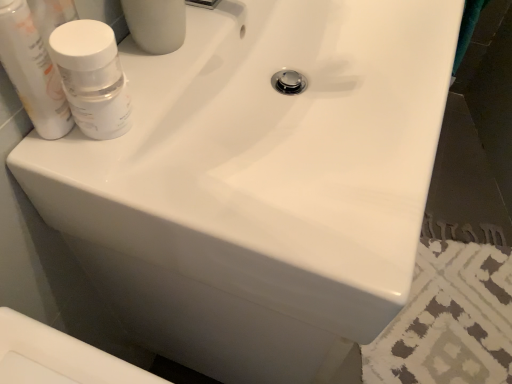
What is the approximate width of white glossy bottle at upper left, acting as the 1th mouthwash starting from the left?

It is 1.73 inches.

Find the location of `white glossy bottle at upper left, acting as the 1th mouthwash starting from the left`. white glossy bottle at upper left, acting as the 1th mouthwash starting from the left is located at coordinates (32, 71).

Describe the element at coordinates (32, 71) in the screenshot. The width and height of the screenshot is (512, 384). I see `white glossy bottle at upper left, acting as the 1th mouthwash starting from the left` at that location.

How much space does white glossy bottle at upper left, acting as the 1th mouthwash starting from the left, occupy vertically?

white glossy bottle at upper left, acting as the 1th mouthwash starting from the left, is 6.80 inches tall.

How much space does white matte bottle at upper left, acting as the second mouthwash starting from the left, occupy horizontally?

white matte bottle at upper left, acting as the second mouthwash starting from the left, is 2.46 inches wide.

Identify the location of white matte bottle at upper left, which is counted as the 1th mouthwash, starting from the right. This screenshot has width=512, height=384. (92, 77).

This screenshot has height=384, width=512. Describe the element at coordinates (92, 77) in the screenshot. I see `white matte bottle at upper left, acting as the second mouthwash starting from the left` at that location.

Identify the location of white glossy bottle at upper left, the 2th mouthwash from the right. The width and height of the screenshot is (512, 384). (32, 71).

Consider the image. Does white matte bottle at upper left, acting as the second mouthwash starting from the left, appear on the right side of white glossy bottle at upper left, acting as the 1th mouthwash starting from the left?

Yes, white matte bottle at upper left, acting as the second mouthwash starting from the left, is to the right of white glossy bottle at upper left, acting as the 1th mouthwash starting from the left.

Considering the relative positions of white matte bottle at upper left, which is counted as the 1th mouthwash, starting from the right, and white glossy bottle at upper left, the 2th mouthwash from the right, in the image provided, is white matte bottle at upper left, which is counted as the 1th mouthwash, starting from the right, in front of white glossy bottle at upper left, the 2th mouthwash from the right,?

No, white matte bottle at upper left, which is counted as the 1th mouthwash, starting from the right, is behind white glossy bottle at upper left, the 2th mouthwash from the right.

Does point (108, 115) lie behind point (1, 58)?

Yes.

From the image's perspective, is white matte bottle at upper left, which is counted as the 1th mouthwash, starting from the right, on white glossy bottle at upper left, acting as the 1th mouthwash starting from the left?

Incorrect, from the image's perspective, white matte bottle at upper left, which is counted as the 1th mouthwash, starting from the right, is lower than white glossy bottle at upper left, acting as the 1th mouthwash starting from the left.

From a real-world perspective, which is physically below, white matte bottle at upper left, which is counted as the 1th mouthwash, starting from the right, or white glossy bottle at upper left, acting as the 1th mouthwash starting from the left?

white matte bottle at upper left, which is counted as the 1th mouthwash, starting from the right, is physically lower.

Considering the sizes of objects white matte bottle at upper left, which is counted as the 1th mouthwash, starting from the right, and white glossy bottle at upper left, the 2th mouthwash from the right, in the image provided, who is thinner, white matte bottle at upper left, which is counted as the 1th mouthwash, starting from the right, or white glossy bottle at upper left, the 2th mouthwash from the right,?

white glossy bottle at upper left, the 2th mouthwash from the right, is thinner.

Who is taller, white matte bottle at upper left, acting as the second mouthwash starting from the left, or white glossy bottle at upper left, acting as the 1th mouthwash starting from the left?

Standing taller between the two is white glossy bottle at upper left, acting as the 1th mouthwash starting from the left.

Who is bigger, white matte bottle at upper left, acting as the second mouthwash starting from the left, or white glossy bottle at upper left, the 2th mouthwash from the right?

With larger size is white matte bottle at upper left, acting as the second mouthwash starting from the left.

Does white matte bottle at upper left, which is counted as the 1th mouthwash, starting from the right, contain white glossy bottle at upper left, the 2th mouthwash from the right?

No.

Is white matte bottle at upper left, acting as the second mouthwash starting from the left, positioned far away from white glossy bottle at upper left, acting as the 1th mouthwash starting from the left?

They are positioned close to each other.

Is white matte bottle at upper left, which is counted as the 1th mouthwash, starting from the right, looking in the opposite direction of white glossy bottle at upper left, the 2th mouthwash from the right?

Absolutely, white matte bottle at upper left, which is counted as the 1th mouthwash, starting from the right, is directed away from white glossy bottle at upper left, the 2th mouthwash from the right.

Where is `mouthwash located underneath the white glossy bottle at upper left, the 2th mouthwash from the right (from a real-world perspective)`? The width and height of the screenshot is (512, 384). mouthwash located underneath the white glossy bottle at upper left, the 2th mouthwash from the right (from a real-world perspective) is located at coordinates (92, 77).

Can you confirm if white glossy bottle at upper left, acting as the 1th mouthwash starting from the left, is positioned to the right of white matte bottle at upper left, acting as the second mouthwash starting from the left?

No.

Which object is closer to the camera, white glossy bottle at upper left, acting as the 1th mouthwash starting from the left, or white matte bottle at upper left, which is counted as the 1th mouthwash, starting from the right?

white glossy bottle at upper left, acting as the 1th mouthwash starting from the left.

Considering the positions of point (70, 122) and point (75, 73), is point (70, 122) closer or farther from the camera than point (75, 73)?

Point (70, 122).

From the image's perspective, is white glossy bottle at upper left, the 2th mouthwash from the right, located beneath white matte bottle at upper left, acting as the second mouthwash starting from the left?

No.

From a real-world perspective, between white glossy bottle at upper left, acting as the 1th mouthwash starting from the left, and white matte bottle at upper left, which is counted as the 1th mouthwash, starting from the right, who is vertically higher?

white glossy bottle at upper left, acting as the 1th mouthwash starting from the left.

Looking at their sizes, would you say white glossy bottle at upper left, acting as the 1th mouthwash starting from the left, is wider or thinner than white matte bottle at upper left, acting as the second mouthwash starting from the left?

white glossy bottle at upper left, acting as the 1th mouthwash starting from the left, is thinner than white matte bottle at upper left, acting as the second mouthwash starting from the left.

Is white glossy bottle at upper left, the 2th mouthwash from the right, shorter than white matte bottle at upper left, acting as the second mouthwash starting from the left?

No, white glossy bottle at upper left, the 2th mouthwash from the right, is not shorter than white matte bottle at upper left, acting as the second mouthwash starting from the left.

Considering the sizes of objects white glossy bottle at upper left, acting as the 1th mouthwash starting from the left, and white matte bottle at upper left, acting as the second mouthwash starting from the left, in the image provided, who is smaller, white glossy bottle at upper left, acting as the 1th mouthwash starting from the left, or white matte bottle at upper left, acting as the second mouthwash starting from the left,?

white glossy bottle at upper left, acting as the 1th mouthwash starting from the left, is smaller.

Is white glossy bottle at upper left, acting as the 1th mouthwash starting from the left, not inside white matte bottle at upper left, acting as the second mouthwash starting from the left?

white glossy bottle at upper left, acting as the 1th mouthwash starting from the left, is positioned outside white matte bottle at upper left, acting as the second mouthwash starting from the left.

Consider the image. Does white glossy bottle at upper left, acting as the 1th mouthwash starting from the left, touch white matte bottle at upper left, acting as the second mouthwash starting from the left?

Yes, white glossy bottle at upper left, acting as the 1th mouthwash starting from the left, is next to white matte bottle at upper left, acting as the second mouthwash starting from the left.

Is white glossy bottle at upper left, acting as the 1th mouthwash starting from the left, looking in the opposite direction of white matte bottle at upper left, acting as the second mouthwash starting from the left?

white glossy bottle at upper left, acting as the 1th mouthwash starting from the left, does not have its back to white matte bottle at upper left, acting as the second mouthwash starting from the left.

How different are the orientations of white glossy bottle at upper left, the 2th mouthwash from the right, and white matte bottle at upper left, acting as the second mouthwash starting from the left, in degrees?

0.000269 degrees.

In order to click on mouthwash in front of the white matte bottle at upper left, which is counted as the 1th mouthwash, starting from the right in this screenshot , I will do `click(32, 71)`.

The image size is (512, 384). I want to click on mouthwash behind the white glossy bottle at upper left, the 2th mouthwash from the right, so click(92, 77).

Find the location of a particular element. The image size is (512, 384). mouthwash that appears in front of the white matte bottle at upper left, acting as the second mouthwash starting from the left is located at coordinates (32, 71).